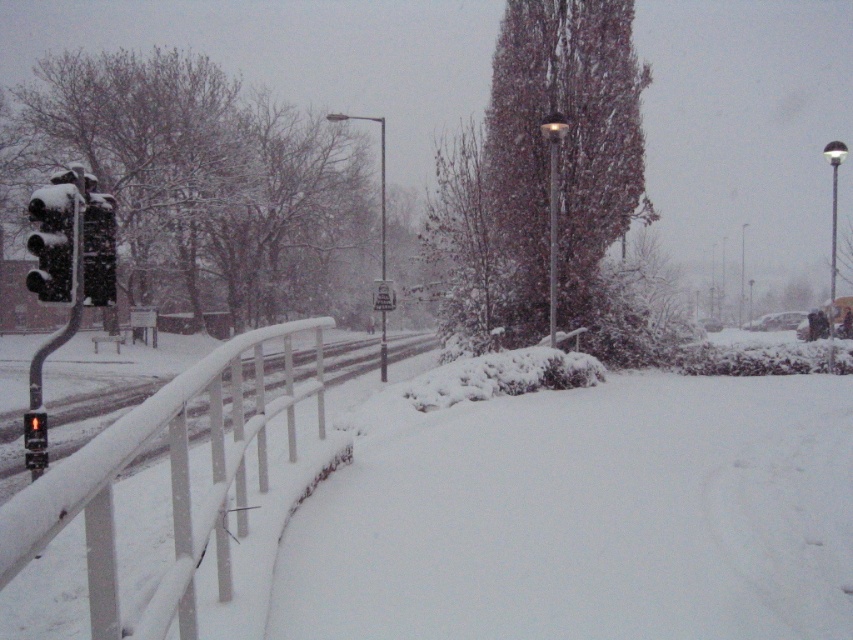
Question: Does black matte traffic light at left have a lesser width compared to metallic pole at center?

Choices:
 (A) no
 (B) yes

Answer: (B)

Question: Which point is farther to the camera?

Choices:
 (A) sleek metallic pole at center
 (B) matte black traffic light at left
 (C) white fluffy snow at center

Answer: (A)

Question: Which is nearer to the matte black traffic light at left?

Choices:
 (A) white matte rail at left
 (B) white fluffy snow at center
 (C) sleek metallic pole at center
 (D) black matte traffic light at left

Answer: (D)

Question: Which point is farther to the camera?

Choices:
 (A) (550, 252)
 (B) (70, 268)
 (C) (469, 470)
 (D) (383, 161)

Answer: (D)

Question: Can you confirm if white matte rail at left is thinner than black matte traffic light at left?

Choices:
 (A) no
 (B) yes

Answer: (A)

Question: In this image, where is matte black traffic light at left located relative to sleek metallic pole at center?

Choices:
 (A) above
 (B) below

Answer: (A)